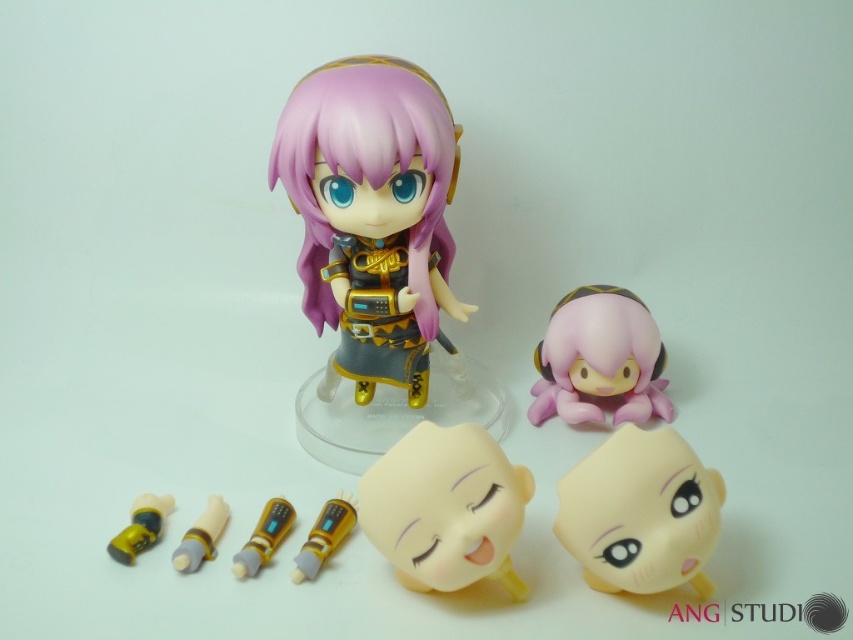
You are an artist trying to sketch the scene. You need to decide which object to draw first based on their sizes. Which one should you start with, the purple matte hair at center or the yellow matte bullet at lower left?

The purple matte hair at center is taller than the yellow matte bullet at lower left, so you should start with the purple matte hair at center since it is larger.

You are an art curator arranging an exhibition. You need to place the purple matte hair at center and the yellow matte bullet at lower left on a shelf. Given that the shelf has limited space, which object requires more horizontal space due to its width?

The purple matte hair at center requires more horizontal space because its width surpasses that of the yellow matte bullet at lower left.